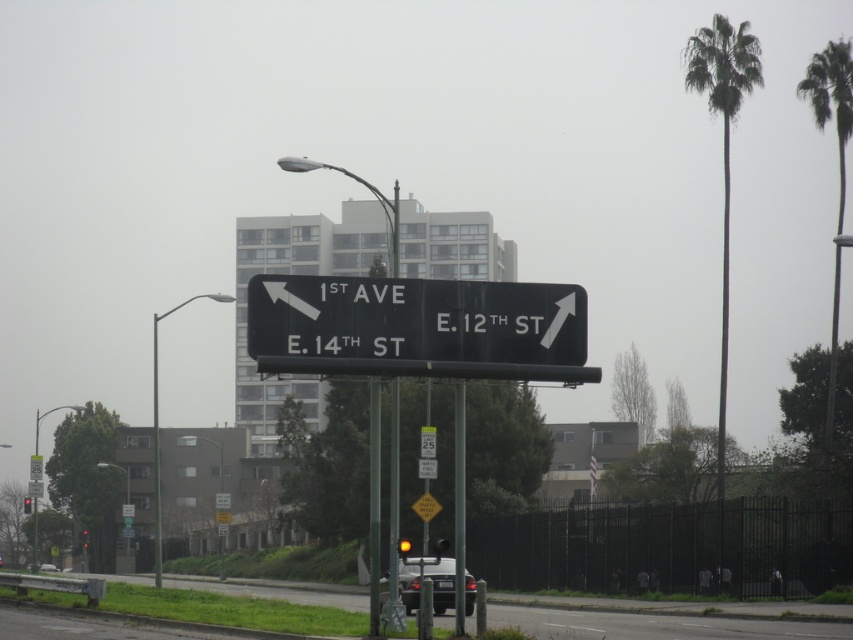
Based on the photo, you are a pedestrian standing on the sidewalk and want to take a photo of both the green leafy palm tree at upper right and the yellow plastic traffic sign at center. Which object should you focus on first to ensure both are in the frame?

You should focus on the green leafy palm tree at upper right first since it is closer to you than the yellow plastic traffic sign at center, allowing you to adjust the camera to include both in the frame.

You are standing at the intersection and see the point marked at coordinates (403,547). What object is located at that point?

The point at coordinates (403,547) marks the yellow glass traffic light at center.

You are standing at point (155,452) and want to walk towards the metallic pole at left. Is the metallic pole at left located to your left or right side?

The metallic pole at left is located to your left side since you are at point (155,452) and the pole is at the left direction from that point.